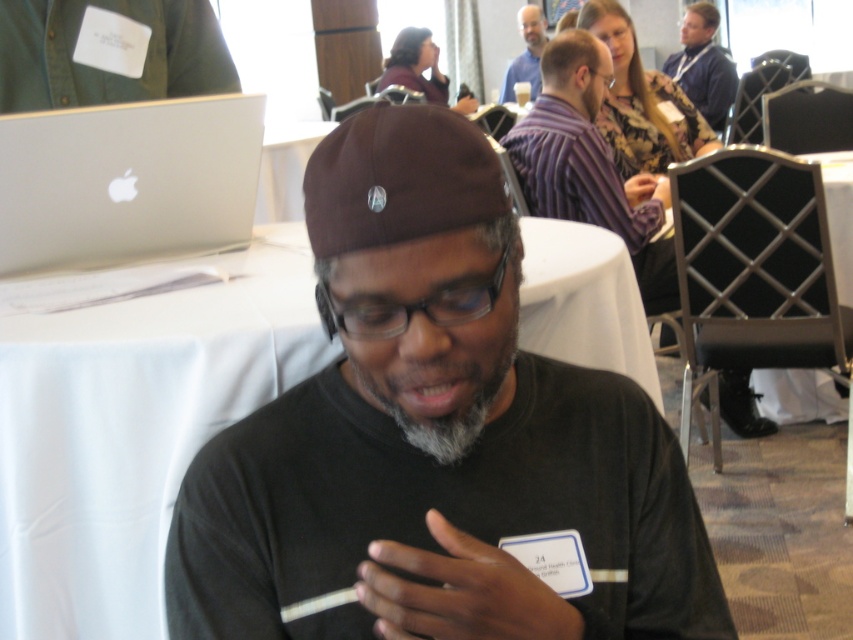
Can you confirm if black matte beanie at center is positioned above blue shirt at upper center?

No.

Consider the image. Measure the distance between black matte beanie at center and blue shirt at upper center.

black matte beanie at center and blue shirt at upper center are 18.40 feet apart.

The image size is (853, 640). What are the coordinates of `black matte beanie at center` in the screenshot? It's located at (434, 436).

Who is positioned more to the right, silver metallic laptop at upper left or green denim name tag at upper left?

From the viewer's perspective, silver metallic laptop at upper left appears more on the right side.

Is silver metallic laptop at upper left above green denim name tag at upper left?

Incorrect, silver metallic laptop at upper left is not positioned above green denim name tag at upper left.

Does point (177, 148) come farther from viewer compared to point (154, 93)?

No, (177, 148) is in front of (154, 93).

This screenshot has width=853, height=640. I want to click on silver metallic laptop at upper left, so click(x=126, y=180).

Can you confirm if purple striped shirt at upper center is wider than matte blue shirt at upper right?

Correct, the width of purple striped shirt at upper center exceeds that of matte blue shirt at upper right.

Does purple striped shirt at upper center lie behind matte blue shirt at upper right?

No, it is in front of matte blue shirt at upper right.

Between point (573, 104) and point (717, 116), which one is positioned behind?

Point (717, 116)

Find the location of `purple striped shirt at upper center`. purple striped shirt at upper center is located at coordinates (590, 164).